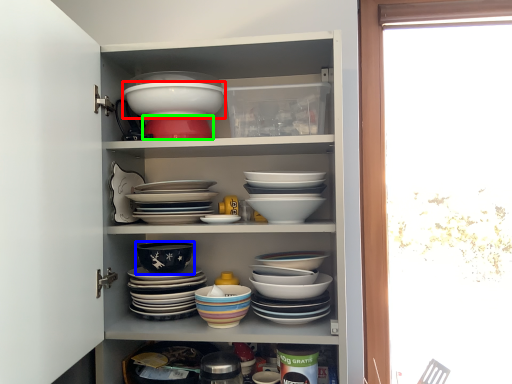
Question: Estimate the real-world distances between objects in this image. Which object is closer to bowl (highlighted by a red box), bowl (highlighted by a blue box) or bowl (highlighted by a green box)?

Choices:
 (A) bowl
 (B) bowl

Answer: (B)